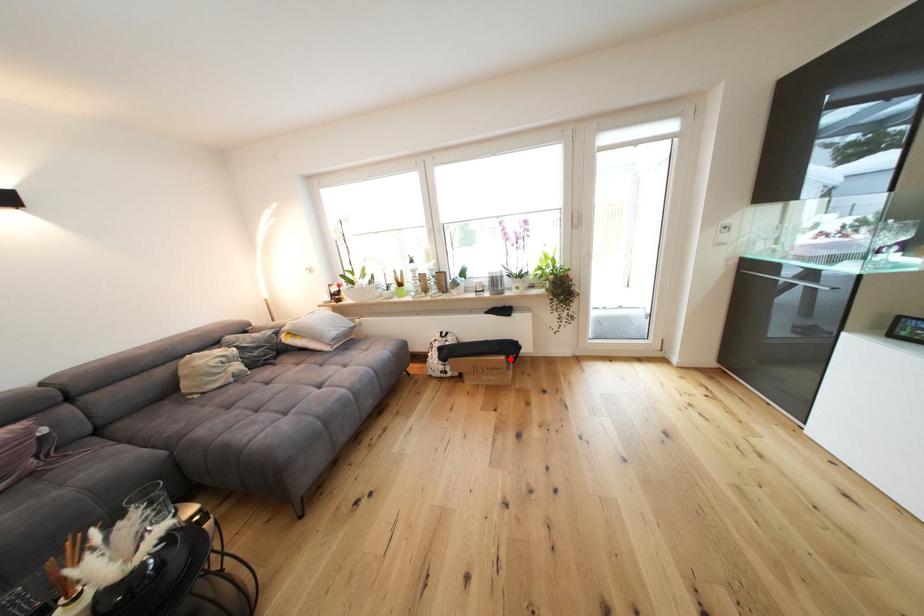
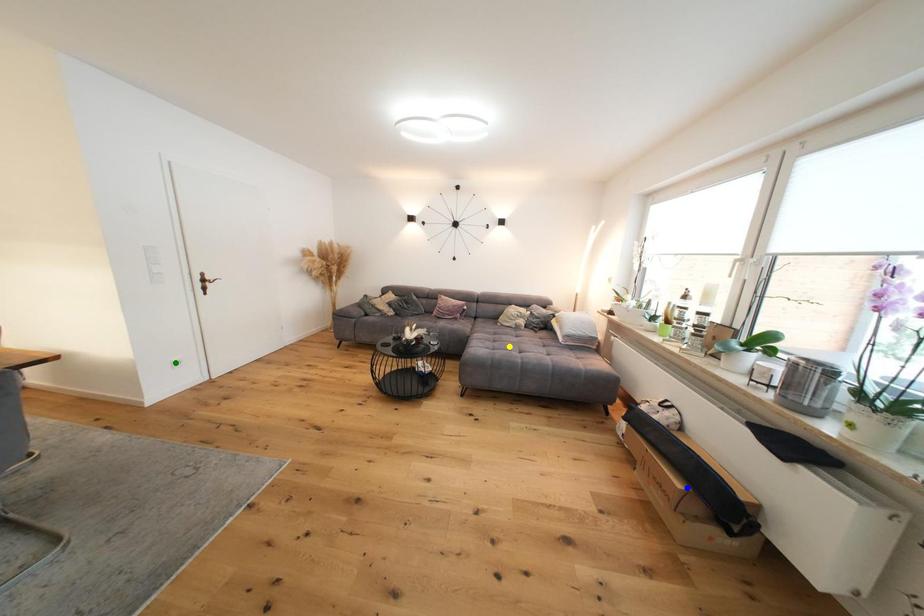
Question: I am providing you with two images of the same scene from different viewpoints. A red point is marked on the first image. You are given multiple points on the second image. Can you choose the point in image 2 that corresponds to the point in image 1?

Choices:
 (A) green point
 (B) yellow point
 (C) blue point

Answer: (C)